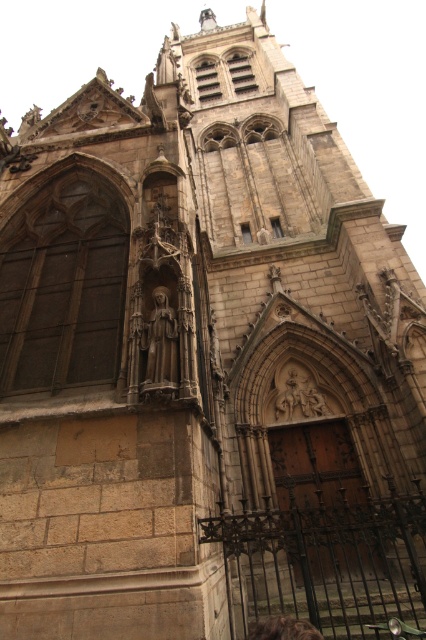
Question: Which of the following is the farthest from the observer?

Choices:
 (A) (157, 342)
 (B) (284, 616)

Answer: (A)

Question: Can you confirm if smooth stone statue at center is wider than brown leather bag at lower center?

Choices:
 (A) yes
 (B) no

Answer: (B)

Question: Can you confirm if smooth stone statue at center is bigger than brown leather bag at lower center?

Choices:
 (A) yes
 (B) no

Answer: (B)

Question: Among these points, which one is farthest from the camera?

Choices:
 (A) (261, 624)
 (B) (166, 332)

Answer: (B)

Question: Which point is closer to the camera?

Choices:
 (A) smooth stone statue at center
 (B) brown leather bag at lower center

Answer: (B)

Question: Is the position of smooth stone statue at center less distant than that of brown leather bag at lower center?

Choices:
 (A) no
 (B) yes

Answer: (A)